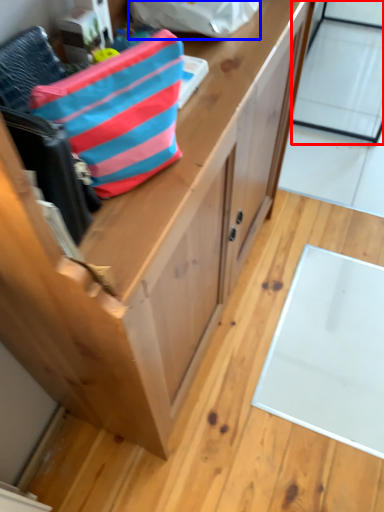
Question: Which point is further to the camera, glass door (highlighted by a red box) or pouch (highlighted by a blue box)?

Choices:
 (A) glass door
 (B) pouch

Answer: (A)